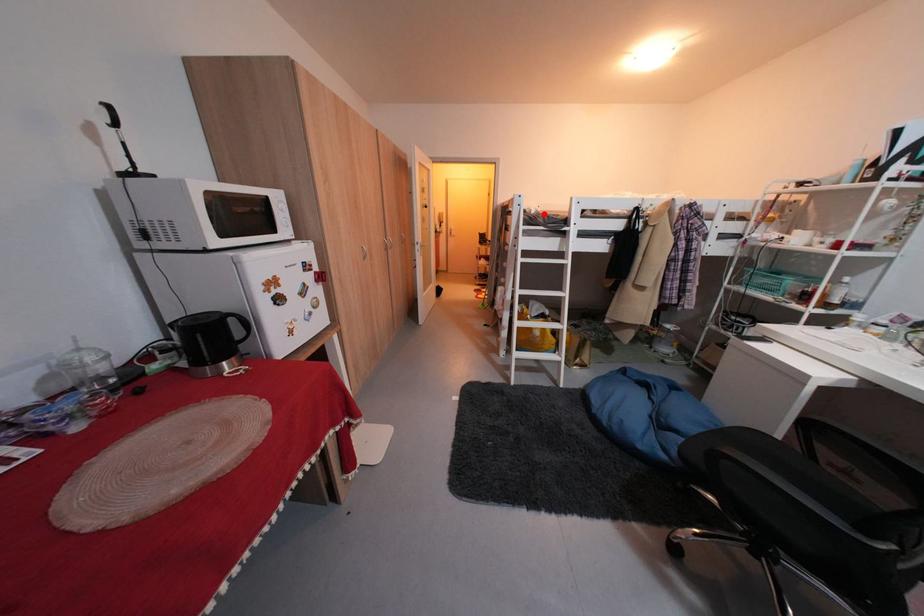
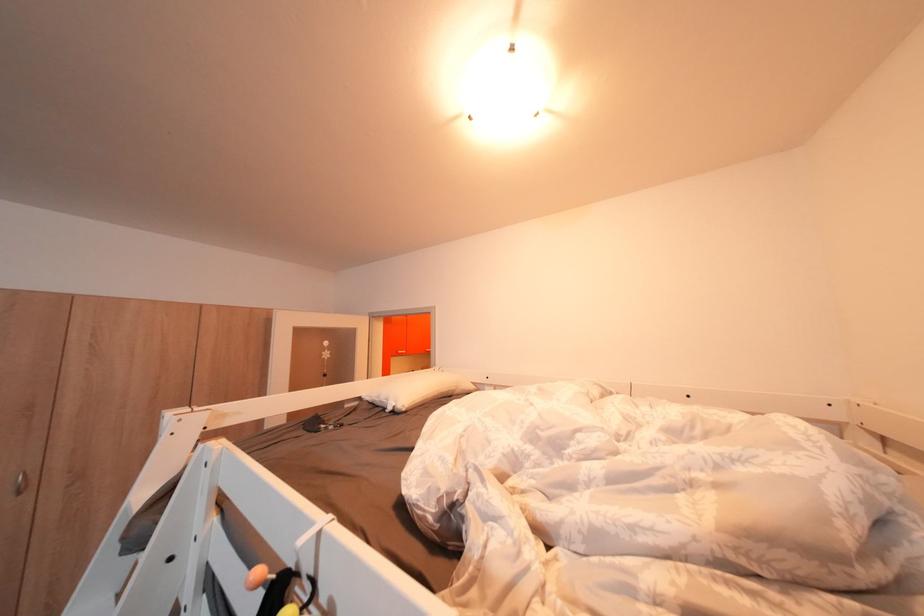
Where in the second image is the point corresponding to the highlighted location from the first image?

(400, 410)